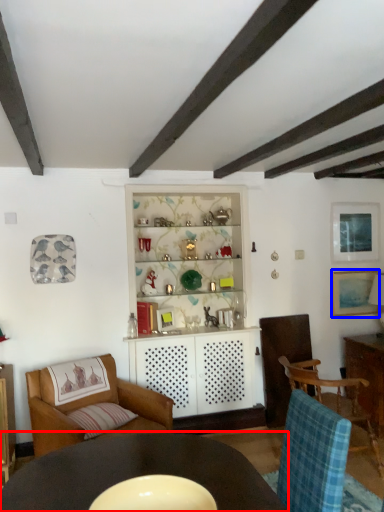
Question: Which object appears closest to the camera in this image, table (highlighted by a red box) or picture frame (highlighted by a blue box)?

Choices:
 (A) table
 (B) picture frame

Answer: (A)